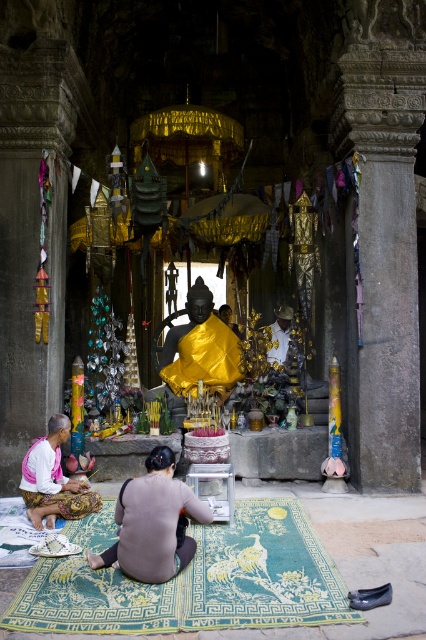
Is green woven mat at lower center bigger than white cotton robe at lower left?

Actually, green woven mat at lower center might be smaller than white cotton robe at lower left.

Between green woven mat at lower center and white cotton robe at lower left, which one appears on the right side from the viewer's perspective?

green woven mat at lower center

Is point (227, 548) closer to viewer compared to point (40, 484)?

Yes.

At what (x,y) coordinates should I click in order to perform the action: click on green woven mat at lower center. Please return your answer as a coordinate pair (x, y). This screenshot has width=426, height=640. Looking at the image, I should click on (198, 582).

Does gray matte fabric at center lie in front of shiny gold statue at center?

Yes.

What do you see at coordinates (152, 522) in the screenshot? I see `gray matte fabric at center` at bounding box center [152, 522].

This screenshot has height=640, width=426. What are the coordinates of `gray matte fabric at center` in the screenshot? It's located at (152, 522).

Is gray matte fabric at center thinner than white cotton robe at lower left?

In fact, gray matte fabric at center might be wider than white cotton robe at lower left.

What do you see at coordinates (152, 522) in the screenshot? I see `gray matte fabric at center` at bounding box center [152, 522].

Who is more forward, [161,547] or [62,481]?

Positioned in front is point [161,547].

At what (x,y) coordinates should I click in order to perform the action: click on gray matte fabric at center. Please return your answer as a coordinate pair (x, y). This screenshot has height=640, width=426. Looking at the image, I should click on (152, 522).